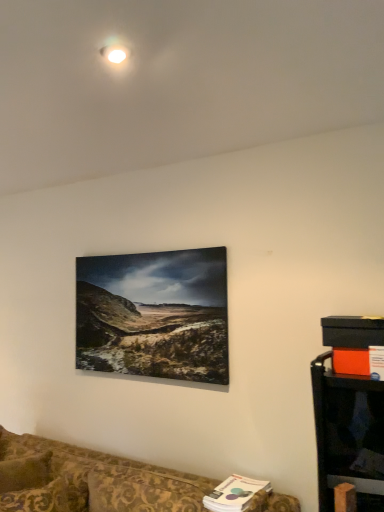
Question: From the image's perspective, is patterned fabric couch at lower left over black plastic entertainment center at lower right?

Choices:
 (A) no
 (B) yes

Answer: (A)

Question: From a real-world perspective, is patterned fabric couch at lower left positioned under black plastic entertainment center at lower right based on gravity?

Choices:
 (A) yes
 (B) no

Answer: (A)

Question: Is patterned fabric couch at lower left next to black plastic entertainment center at lower right?

Choices:
 (A) no
 (B) yes

Answer: (A)

Question: Considering the relative positions of patterned fabric couch at lower left and black plastic entertainment center at lower right in the image provided, is patterned fabric couch at lower left behind black plastic entertainment center at lower right?

Choices:
 (A) no
 (B) yes

Answer: (A)

Question: Are patterned fabric couch at lower left and black plastic entertainment center at lower right located far from each other?

Choices:
 (A) yes
 (B) no

Answer: (B)

Question: Does patterned fabric couch at lower left have a larger size compared to black plastic entertainment center at lower right?

Choices:
 (A) yes
 (B) no

Answer: (A)

Question: Considering the relative positions of black plastic entertainment center at lower right and patterned fabric couch at lower left in the image provided, is black plastic entertainment center at lower right to the right of patterned fabric couch at lower left from the viewer's perspective?

Choices:
 (A) yes
 (B) no

Answer: (A)

Question: Would you consider black plastic entertainment center at lower right to be distant from patterned fabric couch at lower left?

Choices:
 (A) no
 (B) yes

Answer: (A)

Question: From a real-world perspective, is black plastic entertainment center at lower right positioned under patterned fabric couch at lower left based on gravity?

Choices:
 (A) no
 (B) yes

Answer: (A)

Question: Does black plastic entertainment center at lower right have a greater height compared to patterned fabric couch at lower left?

Choices:
 (A) yes
 (B) no

Answer: (B)

Question: Is black plastic entertainment center at lower right thinner than patterned fabric couch at lower left?

Choices:
 (A) yes
 (B) no

Answer: (A)

Question: From a real-world perspective, is black plastic entertainment center at lower right located higher than patterned fabric couch at lower left?

Choices:
 (A) no
 (B) yes

Answer: (B)

Question: From the image's perspective, is patterned fabric couch at lower left located above or below black plastic entertainment center at lower right?

Choices:
 (A) above
 (B) below

Answer: (B)